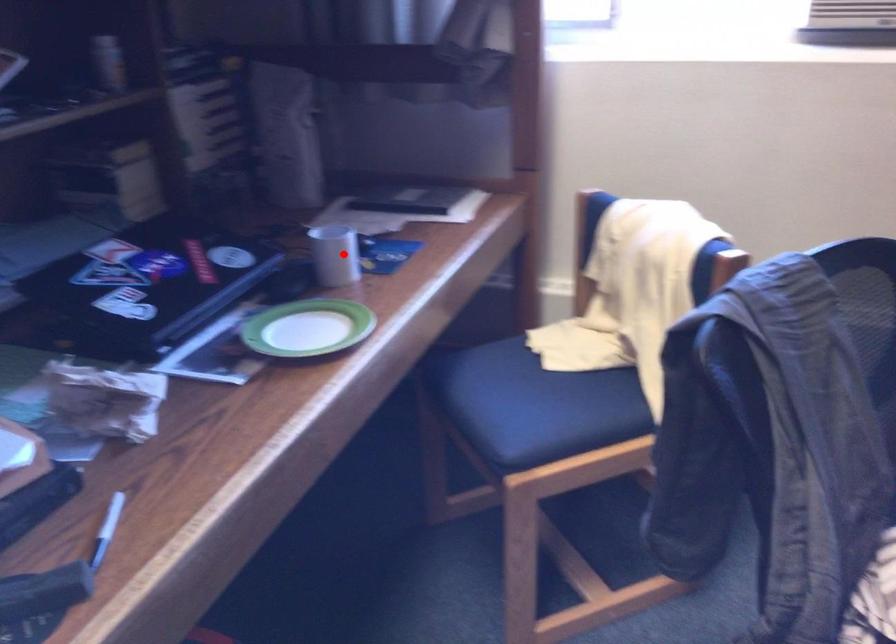
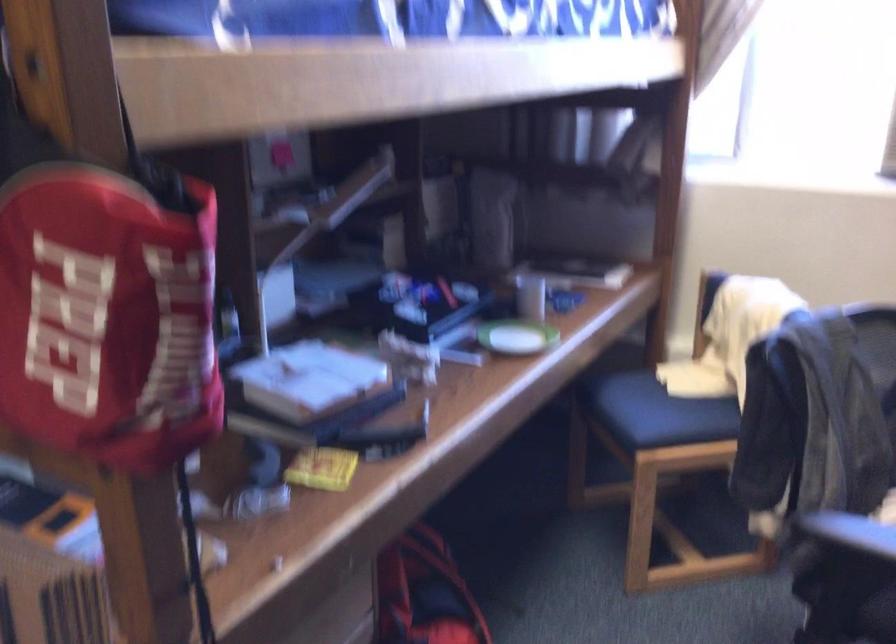
Question: I am providing you with two images of the same scene from different viewpoints. Given a red point in image1, look at the same physical point in image2. Is it:

Choices:
 (A) Closer to the viewpoint
 (B) Farther from the viewpoint

Answer: (B)